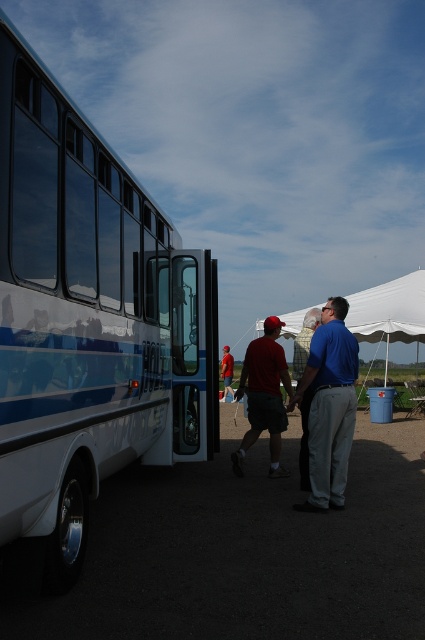
Question: Can you confirm if white glossy bus at left is smaller than blue smooth shirt at center?

Choices:
 (A) no
 (B) yes

Answer: (A)

Question: Where is white glossy bus at left located in relation to blue fabric shirt at center in the image?

Choices:
 (A) left
 (B) right

Answer: (A)

Question: Which of the following is the closest to the observer?

Choices:
 (A) blue fabric shirt at center
 (B) blue smooth shirt at center

Answer: (B)

Question: Which of the following is the closest to the observer?

Choices:
 (A) (231, 456)
 (B) (178, 364)
 (C) (391, 339)
 (D) (306, 339)

Answer: (D)

Question: Is white glossy bus at left bigger than blue fabric shirt at center?

Choices:
 (A) yes
 (B) no

Answer: (A)

Question: Among these objects, which one is farthest from the camera?

Choices:
 (A) matte red cap at center
 (B) blue smooth shirt at center
 (C) white glossy bus at left

Answer: (A)